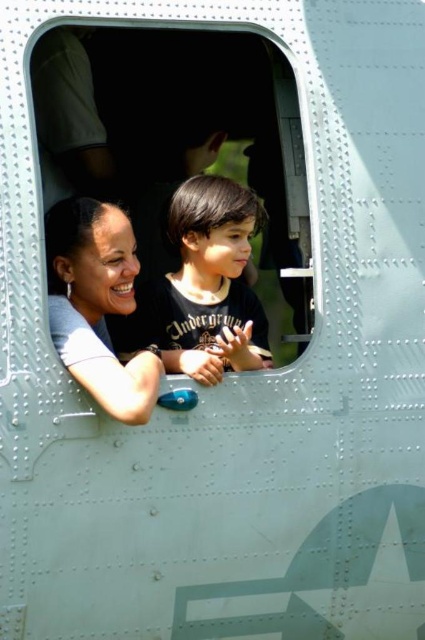
Question: Among these points, which one is nearest to the camera?

Choices:
 (A) (152, 292)
 (B) (246, 257)

Answer: (B)

Question: Considering the relative positions of dark brown hair at center and matte black nose at center in the image provided, where is dark brown hair at center located with respect to matte black nose at center?

Choices:
 (A) above
 (B) below

Answer: (B)

Question: Where is matte gray shirt at upper left located in relation to matte black nose at center in the image?

Choices:
 (A) right
 (B) left

Answer: (B)

Question: Which object is the closest to the matte black nose at center?

Choices:
 (A) dark brown hair at center
 (B) smooth skin nose at center
 (C) matte gray shirt at upper left

Answer: (C)

Question: Which object is closer to the camera taking this photo?

Choices:
 (A) smooth skin nose at center
 (B) matte black nose at center
 (C) dark brown hair at center
 (D) matte gray shirt at upper left

Answer: (D)

Question: Is dark brown hair at center bigger than matte black nose at center?

Choices:
 (A) yes
 (B) no

Answer: (A)